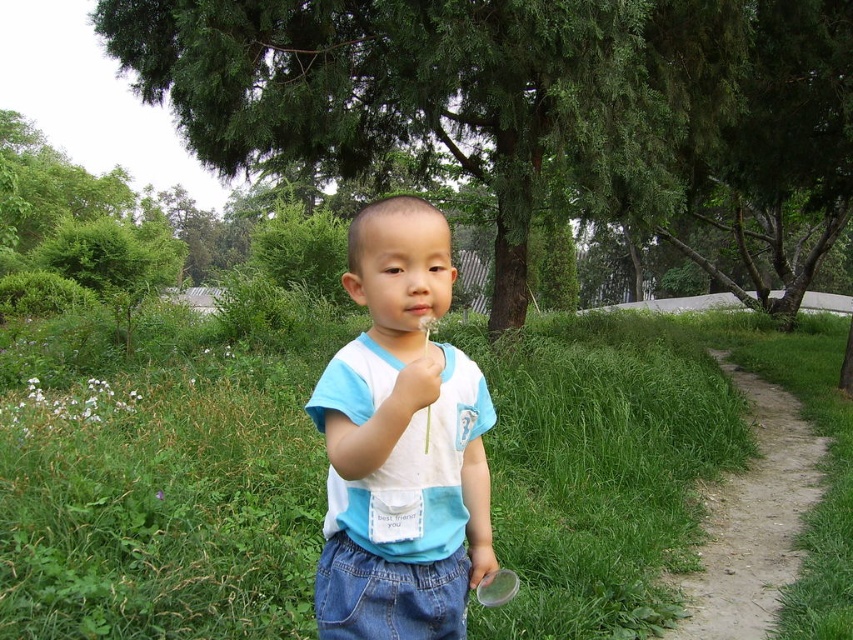
Question: Which point appears closest to the camera in this image?

Choices:
 (A) (x=280, y=538)
 (B) (x=437, y=273)
 (C) (x=425, y=372)

Answer: (C)

Question: Among these points, which one is nearest to the camera?

Choices:
 (A) (349, 390)
 (B) (697, 586)
 (C) (576, 320)
 (D) (422, 372)

Answer: (D)

Question: Which object is the closest to the white matte hand at center?

Choices:
 (A) blue cotton shirt at center
 (B) green grass at center
 (C) dirt path at right

Answer: (A)

Question: Does green grass at center appear under white matte hand at center?

Choices:
 (A) no
 (B) yes

Answer: (B)

Question: Is green grass at center bigger than white matte hand at center?

Choices:
 (A) no
 (B) yes

Answer: (B)

Question: Does blue cotton shirt at center appear on the left side of white matte hand at center?

Choices:
 (A) no
 (B) yes

Answer: (B)